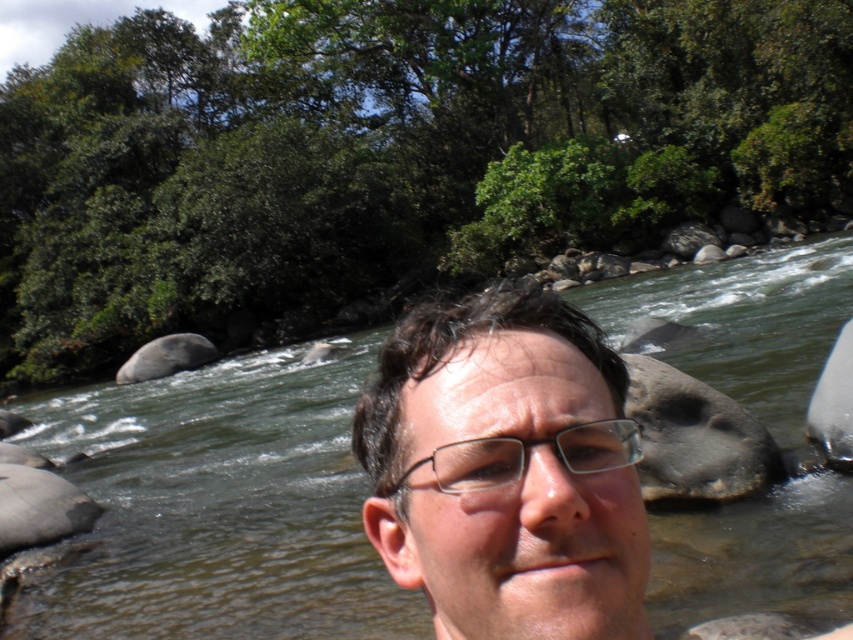
Question: Is matte skin face at center further to the viewer compared to clear plastic glasses at center?

Choices:
 (A) yes
 (B) no

Answer: (B)

Question: Which point appears closest to the camera in this image?

Choices:
 (A) (508, 452)
 (B) (242, 605)

Answer: (A)

Question: In this image, where is matte skin face at center located relative to clear plastic glasses at center?

Choices:
 (A) above
 (B) below

Answer: (B)

Question: Which of the following is the closest to the observer?

Choices:
 (A) (827, 344)
 (B) (567, 548)
 (C) (590, 426)

Answer: (B)

Question: Where is matte skin face at center located in relation to clear plastic glasses at center in the image?

Choices:
 (A) left
 (B) right

Answer: (A)

Question: Which point appears farthest from the camera in this image?

Choices:
 (A) pos(450,470)
 (B) pos(618,362)
 (C) pos(281,426)

Answer: (C)